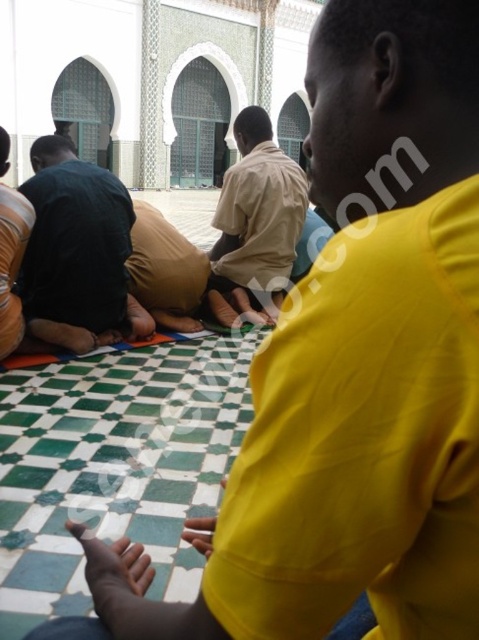
Between beige cotton shirt at center and dark brown leather shoes at lower left, which one has more height?

Standing taller between the two is beige cotton shirt at center.

Measure the distance between beige cotton shirt at center and dark brown leather shoes at lower left.

beige cotton shirt at center and dark brown leather shoes at lower left are 16.05 meters apart.

Identify the location of beige cotton shirt at center. (255, 221).

Who is higher up, dark blue fabric at center or dark brown leather shoes at lower left?

dark blue fabric at center is above.

Does point (144, 321) come behind point (13, 349)?

Yes, it is.

Is point (66, 252) positioned after point (0, 240)?

Yes, point (66, 252) is farther from viewer.

I want to click on dark blue fabric at center, so click(78, 252).

Is point (43, 230) behind point (239, 170)?

No, (43, 230) is closer to viewer.

Find the location of `dark blue fabric at center`. dark blue fabric at center is located at coordinates (78, 252).

What do you see at coordinates (78, 252) in the screenshot? This screenshot has height=640, width=479. I see `dark blue fabric at center` at bounding box center [78, 252].

Identify the location of dark blue fabric at center. This screenshot has width=479, height=640. (78, 252).